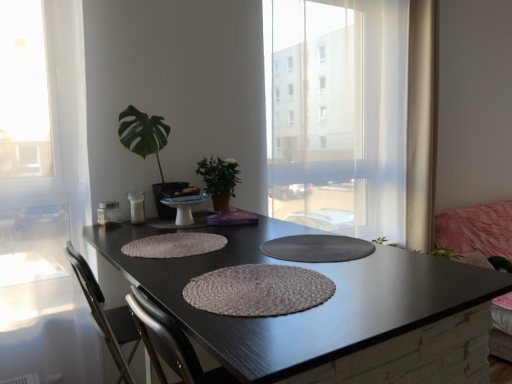
What do you see at coordinates (219, 180) in the screenshot? I see `green matte plant at center, the second houseplant viewed from the left` at bounding box center [219, 180].

Measure the distance between point (x=187, y=186) and camera.

They are 6.66 feet apart.

Describe the element at coordinates (477, 231) in the screenshot. This screenshot has height=384, width=512. I see `pink fabric couch at right` at that location.

The height and width of the screenshot is (384, 512). What do you see at coordinates (174, 245) in the screenshot?
I see `rustic woven placemat at center, placed as the first wide when sorted from back to front` at bounding box center [174, 245].

What do you see at coordinates (258, 290) in the screenshot? This screenshot has width=512, height=384. I see `rustic woven placemat at center, the 1th wide in the front-to-back sequence` at bounding box center [258, 290].

You are a GUI agent. You are given a task and a screenshot of the screen. Output one action in this format:
    pyautogui.click(x=<x>, y=<y>)
    Task: Click on the green matte plant at center, the second houseplant viewed from the left
    Image resolution: width=512 pixels, height=384 pixels.
    Given the screenshot: What is the action you would take?
    pyautogui.click(x=219, y=180)

Is pink fabric couch at right a part of shiny black table at center?

Actually, pink fabric couch at right is outside shiny black table at center.

Considering the relative sizes of shiny black table at center and pink fabric couch at right in the image provided, is shiny black table at center bigger than pink fabric couch at right?

Yes.

Is point (469, 376) farther from viewer compared to point (506, 232)?

No, (469, 376) is closer to viewer.

Between shiny black table at center and pink fabric couch at right, which one is positioned behind?

pink fabric couch at right is further from the camera.

The height and width of the screenshot is (384, 512). What are the coordinates of `wide that is the 2nd object located above the pink fabric couch at right (from the image's perspective)` in the screenshot? It's located at (174, 245).

Which object is wider, pink fabric couch at right or rustic woven placemat at center, placed as the first wide when sorted from back to front?

pink fabric couch at right is wider.

Could you tell me if pink fabric couch at right is turned towards rustic woven placemat at center, which is the second wide in front-to-back order?

No, pink fabric couch at right is not oriented towards rustic woven placemat at center, which is the second wide in front-to-back order.

Is pink fabric couch at right in front of rustic woven placemat at center, placed as the first wide when sorted from back to front?

No.

From the image's perspective, which one is positioned lower, transparent curtain at center or rustic woven placemat at center, placed as the first wide when sorted from back to front?

rustic woven placemat at center, placed as the first wide when sorted from back to front, is shown below in the image.

From a real-world perspective, between transparent curtain at center and rustic woven placemat at center, placed as the first wide when sorted from back to front, who is vertically lower?

In real-world perspective, rustic woven placemat at center, placed as the first wide when sorted from back to front, is lower.

What's the angular difference between transparent curtain at center and rustic woven placemat at center, placed as the first wide when sorted from back to front,'s facing directions?

90 degrees separate the facing orientations of transparent curtain at center and rustic woven placemat at center, placed as the first wide when sorted from back to front.

Consider the image. Is pink fabric couch at right oriented away from transparent curtain at center?

No.

Between pink fabric couch at right and transparent curtain at center, which one appears on the left side from the viewer's perspective?

transparent curtain at center.

Is pink fabric couch at right spatially inside transparent curtain at center, or outside of it?

The correct answer is: outside.

Is white sheer curtain at right inside or outside of green matte plant at center, which is the first houseplant in right-to-left order?

white sheer curtain at right cannot be found inside green matte plant at center, which is the first houseplant in right-to-left order.

Is white sheer curtain at right not near green matte plant at center, which is the first houseplant in right-to-left order?

Yes, white sheer curtain at right is far from green matte plant at center, which is the first houseplant in right-to-left order.

Considering the positions of objects white sheer curtain at right and green matte plant at center, the second houseplant viewed from the left, in the image provided, who is in front, white sheer curtain at right or green matte plant at center, the second houseplant viewed from the left,?

green matte plant at center, the second houseplant viewed from the left, is in front.

From the picture: From the image's perspective, which one is positioned lower, white sheer curtain at right or green matte plant at center, which is the first houseplant in right-to-left order?

green matte plant at center, which is the first houseplant in right-to-left order, appears lower in the image.

From a real-world perspective, is green matte plant at center, which is the first houseplant in right-to-left order, physically below white sheer curtain at right?

Indeed, from a real-world perspective, green matte plant at center, which is the first houseplant in right-to-left order, is positioned beneath white sheer curtain at right.

From the picture: Which of these two, green matte plant at center, which is the first houseplant in right-to-left order, or white sheer curtain at right, is wider?

green matte plant at center, which is the first houseplant in right-to-left order.

Who is bigger, green matte plant at center, the second houseplant viewed from the left, or white sheer curtain at right?

white sheer curtain at right.

From the image's perspective, is green matte plant at center, the second houseplant viewed from the left, beneath white sheer curtain at right?

Correct, green matte plant at center, the second houseplant viewed from the left, appears lower than white sheer curtain at right in the image.

From the image's perspective, count 1st wides downward from the white sheer curtain at right and point to it. Please provide its 2D coordinates.

[(174, 245)]

Are white sheer curtain at right and rustic woven placemat at center, placed as the first wide when sorted from back to front, making contact?

No, white sheer curtain at right is not making contact with rustic woven placemat at center, placed as the first wide when sorted from back to front.

Is white sheer curtain at right facing towards rustic woven placemat at center, which is the second wide in front-to-back order?

No, white sheer curtain at right is not facing towards rustic woven placemat at center, which is the second wide in front-to-back order.

You are a GUI agent. You are given a task and a screenshot of the screen. Output one action in this format:
    pyautogui.click(x=<x>, y=<y>)
    Task: Click on the coffee table that is below the pink fabric couch at right (from the image's perspective)
    The width and height of the screenshot is (512, 384).
    Given the screenshot: What is the action you would take?
    pyautogui.click(x=315, y=308)

The image size is (512, 384). Identify the location of couch that is on the right side of rustic woven placemat at center, which is the second wide in front-to-back order. (477, 231).

When comparing their distances from white sheer curtain at right, does shiny black table at center or green matte plant at center, the second houseplant viewed from the left, seem closer?

green matte plant at center, the second houseplant viewed from the left, is positioned closer to the anchor white sheer curtain at right.

Considering their positions, is rustic woven placemat at center, which is the second wide in front-to-back order, positioned closer to rustic woven placemat at center, which is the second wide from back to front, than green glossy leafy plant at upper left, the 2th houseplant positioned from the right?

rustic woven placemat at center, which is the second wide in front-to-back order, is closer to rustic woven placemat at center, which is the second wide from back to front.

When comparing their distances from white sheer curtain at right, does green glossy leafy plant at upper left, the 2th houseplant positioned from the right, or shiny black table at center seem closer?

shiny black table at center is positioned closer to the anchor white sheer curtain at right.

Estimate the real-world distances between objects in this image. Which object is closer to green glossy leafy plant at upper left, the 2th houseplant positioned from the right, rustic woven placemat at center, placed as the first wide when sorted from back to front, or rustic woven placemat at center, which is the second wide from back to front?

rustic woven placemat at center, placed as the first wide when sorted from back to front, is positioned closer to the anchor green glossy leafy plant at upper left, the 2th houseplant positioned from the right.

Looking at the image, which one is located further to green matte plant at center, which is the first houseplant in right-to-left order, shiny black table at center or rustic woven placemat at center, which is the second wide in front-to-back order?

shiny black table at center lies further to green matte plant at center, which is the first houseplant in right-to-left order, than the other object.

When comparing their distances from rustic woven placemat at center, placed as the first wide when sorted from back to front, does shiny black table at center or green glossy leafy plant at upper left, the first houseplant positioned from the left, seem closer?

shiny black table at center.

Based on their spatial positions, is green matte plant at center, which is the first houseplant in right-to-left order, or transparent curtain at center further from pink fabric couch at right?

green matte plant at center, which is the first houseplant in right-to-left order, is further to pink fabric couch at right.

Which object lies further to the anchor point green matte plant at center, which is the first houseplant in right-to-left order, rustic woven placemat at center, which is the second wide from back to front, or white sheer curtain at right?

The object further to green matte plant at center, which is the first houseplant in right-to-left order, is white sheer curtain at right.

Identify the location of coffee table between green glossy leafy plant at upper left, the 2th houseplant positioned from the right, and pink fabric couch at right, in the horizontal direction. This screenshot has width=512, height=384. (315, 308).

This screenshot has width=512, height=384. What are the coordinates of `wide between shiny black table at center and rustic woven placemat at center, placed as the first wide when sorted from back to front, in the front-back direction` in the screenshot? It's located at (258, 290).

Locate an element on the screen. This screenshot has width=512, height=384. houseplant between green glossy leafy plant at upper left, the first houseplant positioned from the left, and transparent curtain at center, in the horizontal direction is located at coordinates (219, 180).

Identify the location of window located between shiny black table at center and white sheer curtain at right in the depth direction. (337, 114).